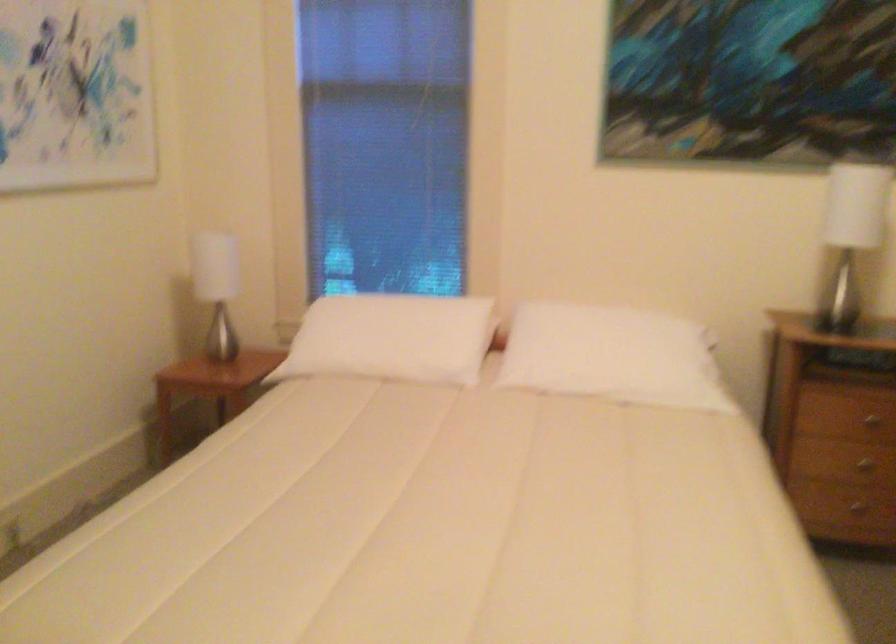
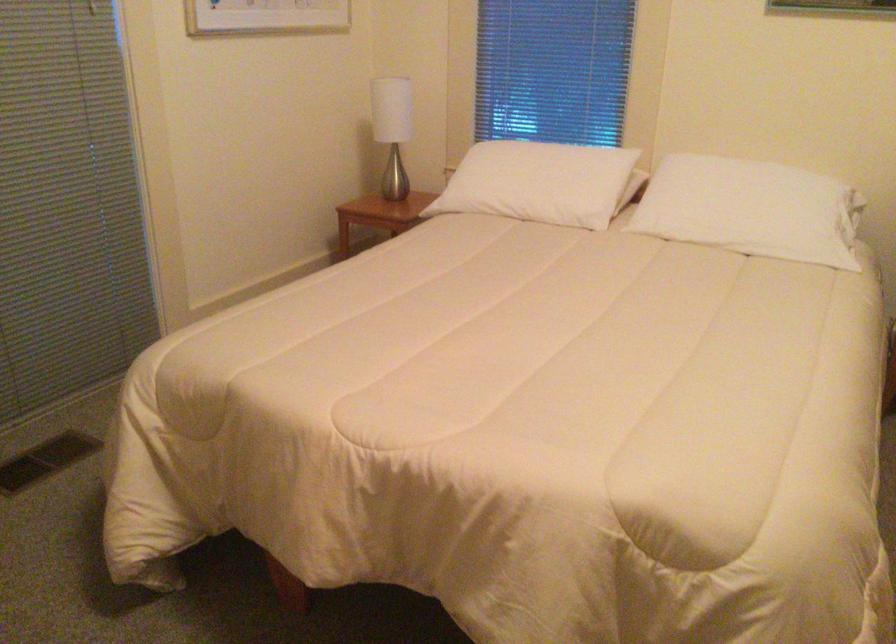
Where in the second image is the point corresponding to [220,292] from the first image?

(392, 129)